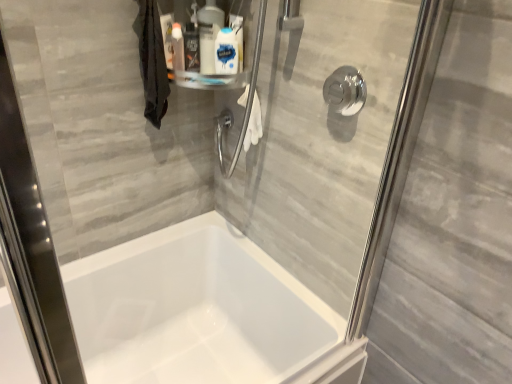
Question: From a real-world perspective, is white glossy bottle at upper center, which is the 3th cleaning product in left-to-right order, above or below polished chrome shower handle at upper right?

Choices:
 (A) below
 (B) above

Answer: (B)

Question: Is white glossy bottle at upper center, which is the 3th cleaning product in left-to-right order, wider or thinner than polished chrome shower handle at upper right?

Choices:
 (A) thin
 (B) wide

Answer: (A)

Question: Considering the real-world distances, which object is closest to the white glossy bottle at upper center, the second cleaning product from the right?

Choices:
 (A) white glossy bottle at upper center, which is the 3th cleaning product in left-to-right order
 (B) polished chrome shower handle at upper right
 (C) translucent plastic spray bottle at upper center, marked as the 1th cleaning product in a left-to-right arrangement

Answer: (A)

Question: Which of these objects is positioned closest to the white glossy bottle at upper center, which is the 3th cleaning product in left-to-right order?

Choices:
 (A) white glossy bottle at upper center, which ranks as the second cleaning product in left-to-right order
 (B) translucent plastic spray bottle at upper center, which appears as the 3th cleaning product when viewed from the right
 (C) polished chrome shower handle at upper right

Answer: (A)